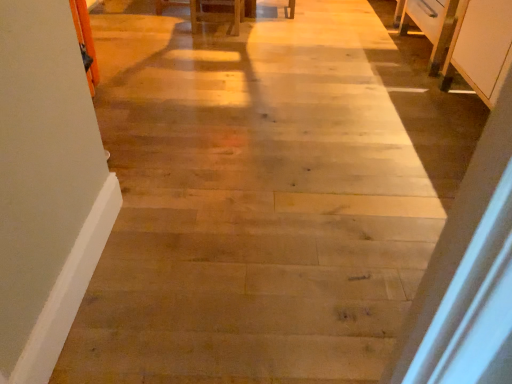
Question: Should I look upward or downward to see white matte cabinet at right?

Choices:
 (A) down
 (B) up

Answer: (B)